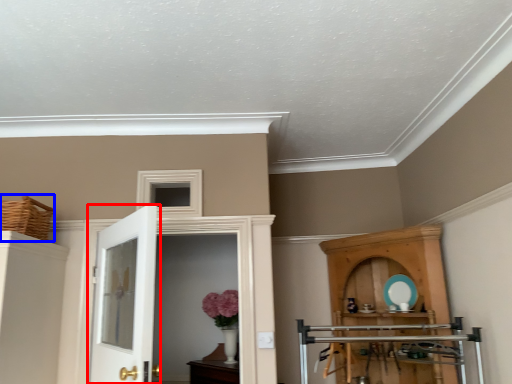
Question: Which of the following is the farthest to the observer, door (highlighted by a red box) or basket (highlighted by a blue box)?

Choices:
 (A) door
 (B) basket

Answer: (B)